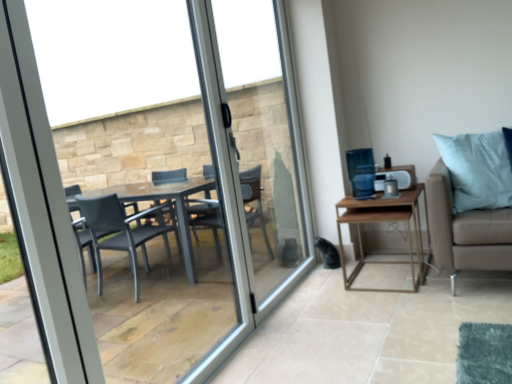
This screenshot has width=512, height=384. Find the location of `wooden table at right`. wooden table at right is located at coordinates (384, 221).

Where is `transparent glass window at center`? This screenshot has height=384, width=512. transparent glass window at center is located at coordinates [149, 185].

From the image's perspective, is clear glass door at center located above or below transparent glass window at center?

Based on their image positions, clear glass door at center is located above transparent glass window at center.

Is clear glass door at center at the left side of transparent glass window at center?

No, clear glass door at center is not to the left of transparent glass window at center.

The image size is (512, 384). Identify the location of screen door that is on the right side of transparent glass window at center. (262, 166).

Considering the sizes of objects transparent glass window at center and wooden table at right in the image provided, who is smaller, transparent glass window at center or wooden table at right?

With smaller size is wooden table at right.

The image size is (512, 384). What are the coordinates of `window that is above the wooden table at right (from the image's perspective)` in the screenshot? It's located at (149, 185).

Considering the relative sizes of transparent glass window at center and wooden table at right in the image provided, is transparent glass window at center thinner than wooden table at right?

Correct, the width of transparent glass window at center is less than that of wooden table at right.

Find the location of `screen door located above the transparent glass window at center (from the image's perspective)`. screen door located above the transparent glass window at center (from the image's perspective) is located at coordinates (262, 166).

Does point (139, 190) appear closer or farther from the camera than point (265, 304)?

Point (139, 190).

From the image's perspective, is transparent glass window at center above clear glass door at center?

No, from the image's perspective, transparent glass window at center is not above clear glass door at center.

Which of these two, transparent glass window at center or clear glass door at center, is bigger?

With larger size is clear glass door at center.

Considering the sizes of wooden table at right and transparent glass window at center in the image, is wooden table at right taller or shorter than transparent glass window at center?

Clearly, wooden table at right is shorter compared to transparent glass window at center.

Find the location of `window in front of the wooden table at right`. window in front of the wooden table at right is located at coordinates (149, 185).

From a real-world perspective, which is physically above, wooden table at right or transparent glass window at center?

From a 3D spatial view, transparent glass window at center is above.

Is wooden table at right closer to camera compared to transparent glass window at center?

No, the depth of wooden table at right is greater than that of transparent glass window at center.

Which point is more distant from viewer, [343,216] or [194,28]?

Positioned behind is point [343,216].

Which object is further away from the camera, wooden table at right or clear glass door at center?

wooden table at right is further from the camera.

From the image's perspective, which one is positioned lower, wooden table at right or clear glass door at center?

wooden table at right is shown below in the image.

Between wooden table at right and clear glass door at center, which one has larger size?

Bigger between the two is clear glass door at center.

Looking at this image, is wooden table at right completely or partially inside clear glass door at center?

No, wooden table at right is not inside clear glass door at center.

From a real-world perspective, relative to wooden table at right, is clear glass door at center vertically above or below?

Clearly, from a real-world perspective, clear glass door at center is above wooden table at right.

Between clear glass door at center and wooden table at right, which one has less height?

wooden table at right is shorter.

Which object is positioned more to the left, clear glass door at center or wooden table at right?

Positioned to the left is clear glass door at center.

You are a GUI agent. You are given a task and a screenshot of the screen. Output one action in this format:
    pyautogui.click(x=<x>, y=<y>)
    Task: Click on the window lying in front of the clear glass door at center
    Image resolution: width=512 pixels, height=384 pixels.
    Given the screenshot: What is the action you would take?
    pyautogui.click(x=149, y=185)

I want to click on table below the transparent glass window at center (from the image's perspective), so click(384, 221).

Considering their positions, is clear glass door at center positioned further to wooden table at right than transparent glass window at center?

transparent glass window at center lies further to wooden table at right than the other object.

Estimate the real-world distances between objects in this image. Which object is closer to transparent glass window at center, clear glass door at center or wooden table at right?

clear glass door at center is closer to transparent glass window at center.

Based on their spatial positions, is transparent glass window at center or wooden table at right closer to clear glass door at center?

transparent glass window at center is positioned closer to the anchor clear glass door at center.

Based on their spatial positions, is wooden table at right or clear glass door at center closer to transparent glass window at center?

clear glass door at center.

Considering their positions, is wooden table at right positioned closer to clear glass door at center than transparent glass window at center?

Based on the image, transparent glass window at center appears to be nearer to clear glass door at center.

From the picture: Which object lies nearer to the anchor point wooden table at right, transparent glass window at center or clear glass door at center?

clear glass door at center is positioned closer to the anchor wooden table at right.

Image resolution: width=512 pixels, height=384 pixels. I want to click on screen door between transparent glass window at center and wooden table at right from front to back, so click(x=262, y=166).